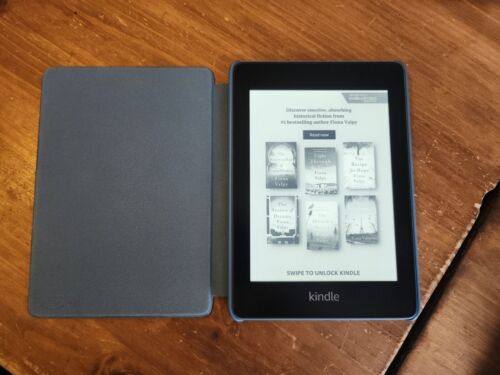
Find the location of a particular element. scuff marks on wooden table is located at coordinates (432, 145), (468, 221), (461, 241), (443, 275), (291, 339).